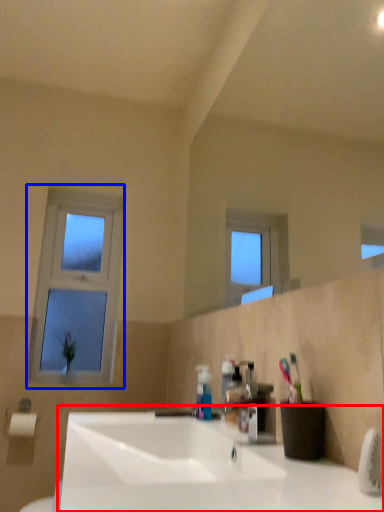
Question: Which of the following is the farthest to the observer, sink (highlighted by a red box) or window (highlighted by a blue box)?

Choices:
 (A) sink
 (B) window

Answer: (B)